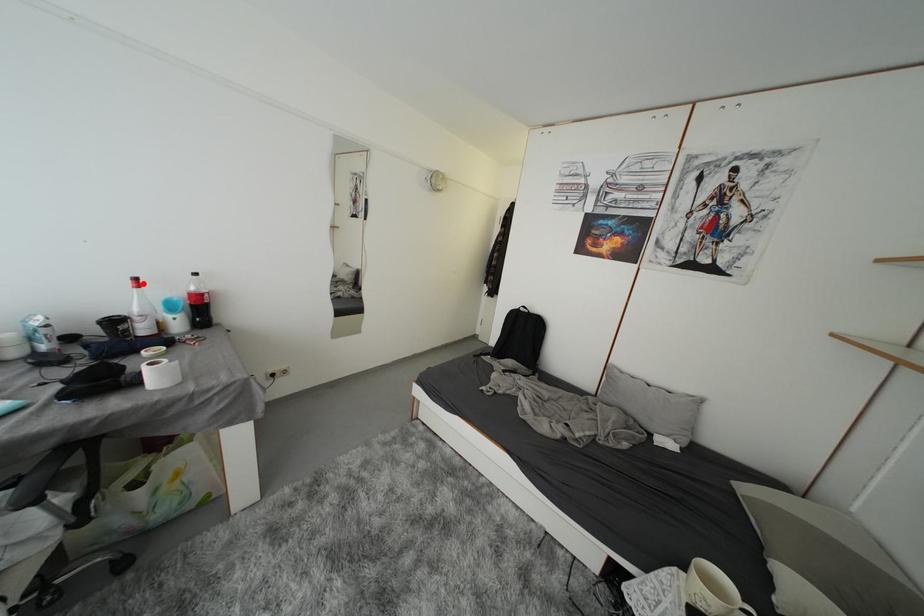
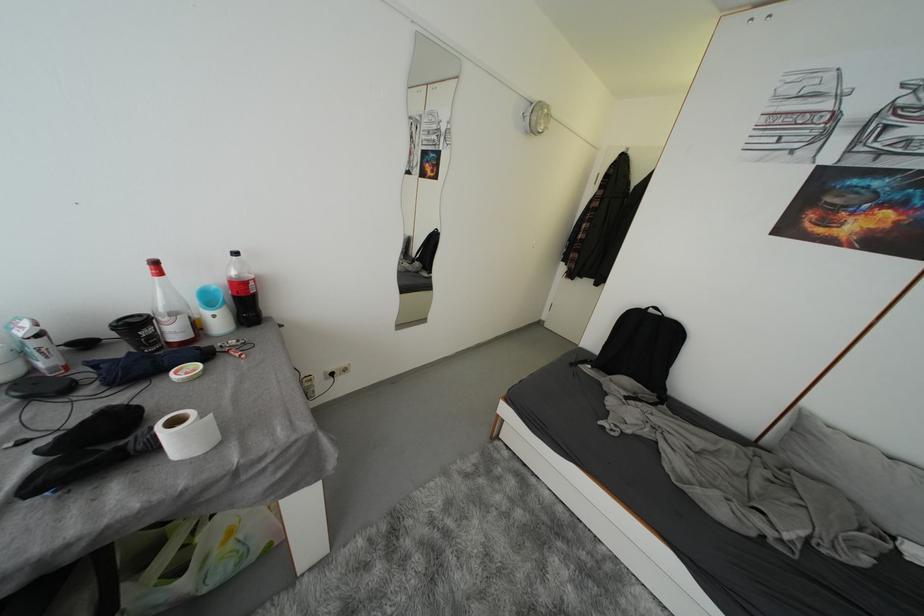
In the second image, find the point that corresponds to the highlighted location in the first image.

(162, 267)